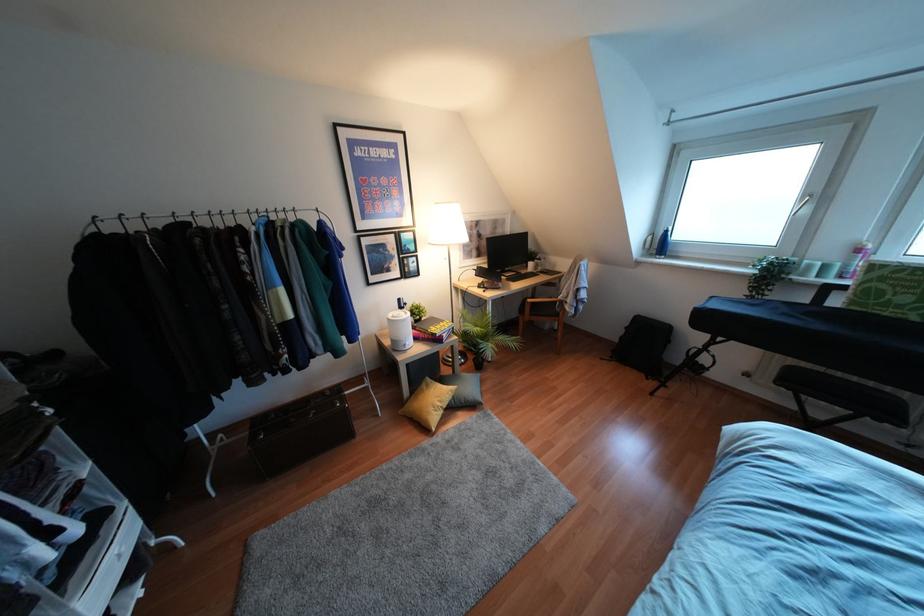
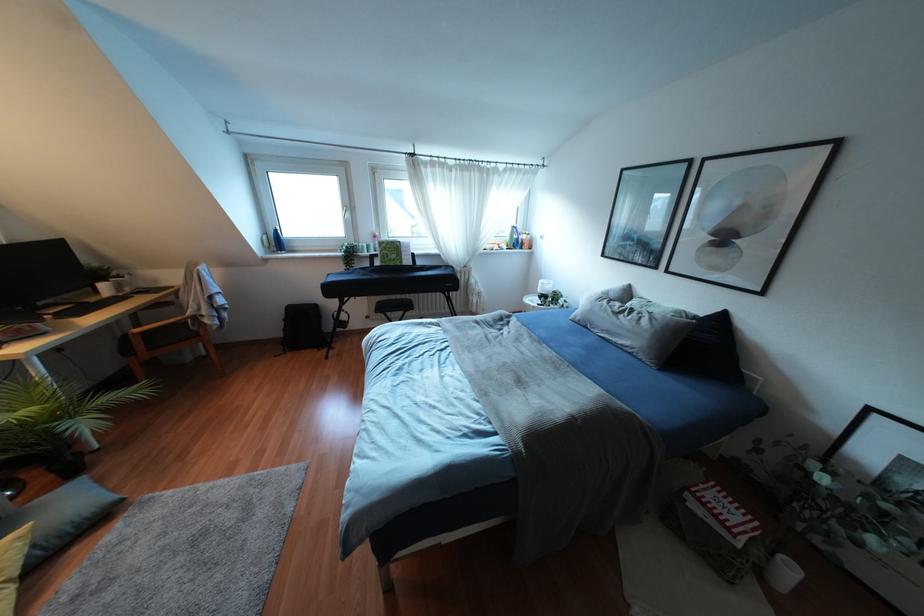
Where in the second image is the point corresponding to (806,209) from the first image?

(346, 215)